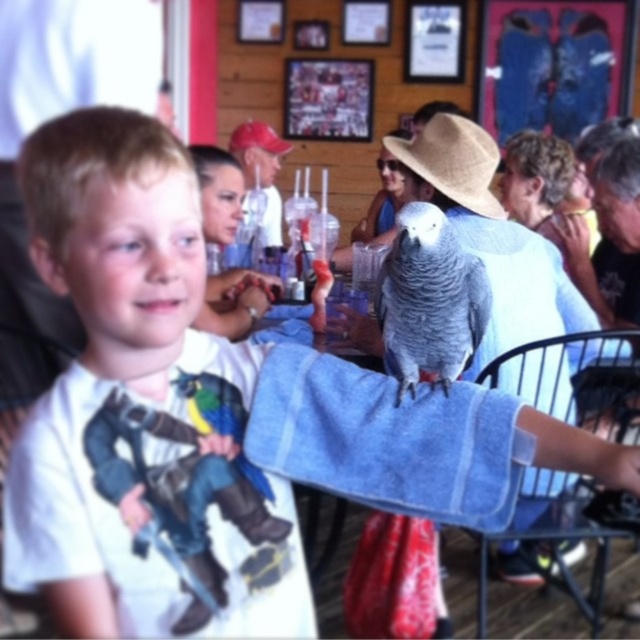
Question: Does multicolored feathered parrot at center lie behind straw hat at upper center?

Choices:
 (A) yes
 (B) no

Answer: (B)

Question: Does multicolored feathered parrot at center appear under straw hat at upper center?

Choices:
 (A) yes
 (B) no

Answer: (A)

Question: Which of these objects is positioned farthest from the multicolored feathered parrot at center?

Choices:
 (A) gray matte parrot at center
 (B) straw hat at center
 (C) straw hat at upper center

Answer: (C)

Question: Which of the following is the closest to the observer?

Choices:
 (A) (228, 147)
 (B) (435, 380)
 (C) (484, 195)
 (D) (268, 481)

Answer: (D)

Question: Estimate the real-world distances between objects in this image. Which object is farther from the straw hat at center?

Choices:
 (A) gray matte parrot at center
 (B) multicolored feathered parrot at center
 (C) straw hat at upper center

Answer: (C)

Question: Is straw hat at center thinner than multicolored feathered parrot at center?

Choices:
 (A) no
 (B) yes

Answer: (A)